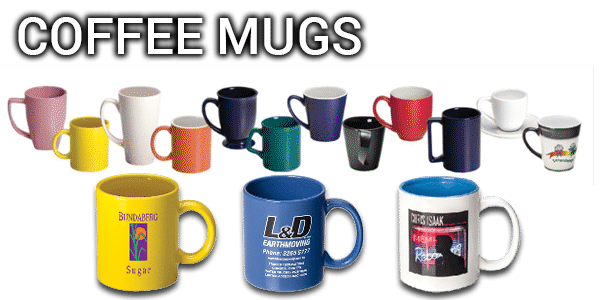
I want to click on yellow mugs, so click(x=161, y=271), click(x=83, y=155).